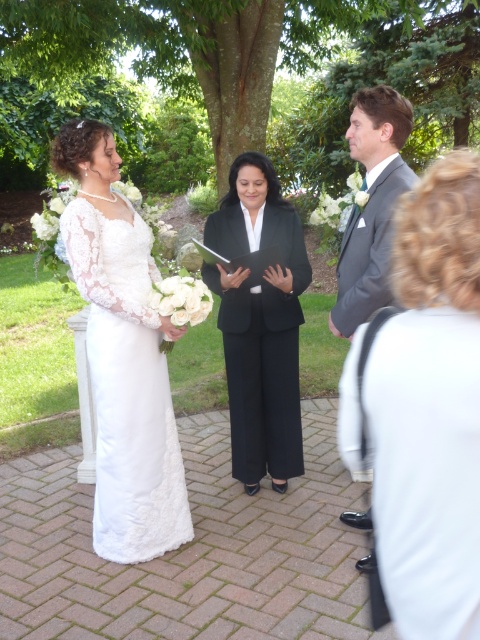
Question: Does black smooth suit at center appear on the left side of matte gray suit at center?

Choices:
 (A) yes
 (B) no

Answer: (A)

Question: Does satin black dress at center have a greater width compared to black smooth suit at center?

Choices:
 (A) no
 (B) yes

Answer: (A)

Question: Estimate the real-world distances between objects in this image. Which object is closer to the black smooth suit at center?

Choices:
 (A) satin black dress at center
 (B) white lace dress at left
 (C) matte gray suit at center

Answer: (C)

Question: Which point is farther to the camera?

Choices:
 (A) (269, 321)
 (B) (127, 376)

Answer: (A)

Question: Which object appears farthest from the camera in this image?

Choices:
 (A) matte gray suit at center
 (B) satin black dress at center

Answer: (A)

Question: Is satin black dress at center above white lace dress at left?

Choices:
 (A) yes
 (B) no

Answer: (B)